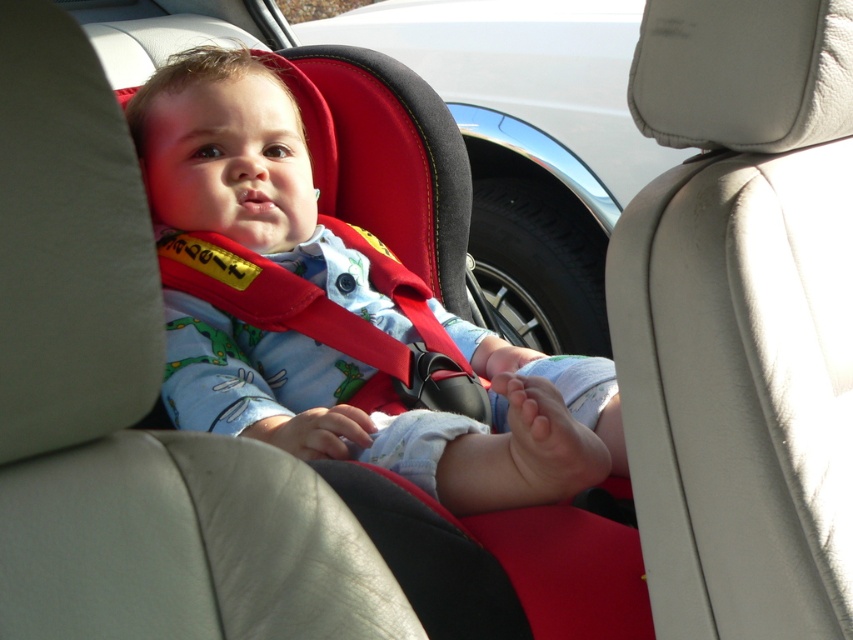
Between matte red car seat at center and matte black car seat at upper center, which one appears on the left side from the viewer's perspective?

From the viewer's perspective, matte red car seat at center appears more on the left side.

Which of these two, matte red car seat at center or matte black car seat at upper center, stands shorter?

matte red car seat at center

Locate an element on the screen. matte red car seat at center is located at coordinates (339, 314).